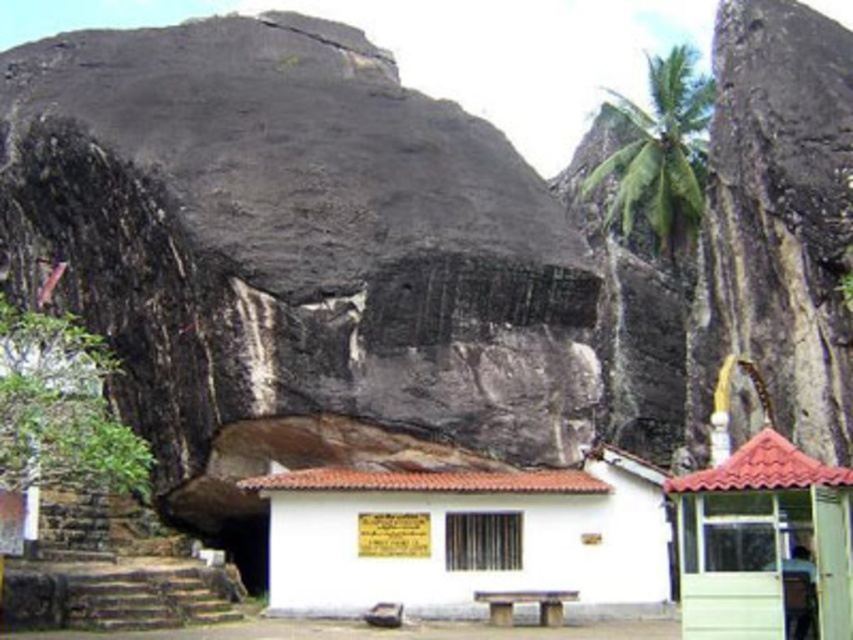
Question: Which point is farther to the camera?

Choices:
 (A) (466, 515)
 (B) (813, 522)
 (C) (701, 81)

Answer: (C)

Question: Does green plastic hut at lower right have a smaller size compared to green leafy palm tree at upper right?

Choices:
 (A) yes
 (B) no

Answer: (A)

Question: Is green plastic hut at lower right in front of green leafy palm tree at upper right?

Choices:
 (A) no
 (B) yes

Answer: (B)

Question: From the image, what is the correct spatial relationship of white painted wood hut at center in relation to green plastic hut at lower right?

Choices:
 (A) below
 (B) above

Answer: (A)

Question: Among these objects, which one is nearest to the camera?

Choices:
 (A) white painted wood hut at center
 (B) green plastic hut at lower right
 (C) green leafy palm tree at upper right

Answer: (B)

Question: Which object appears farthest from the camera in this image?

Choices:
 (A) white painted wood hut at center
 (B) green plastic hut at lower right
 (C) green leafy palm tree at upper right

Answer: (C)